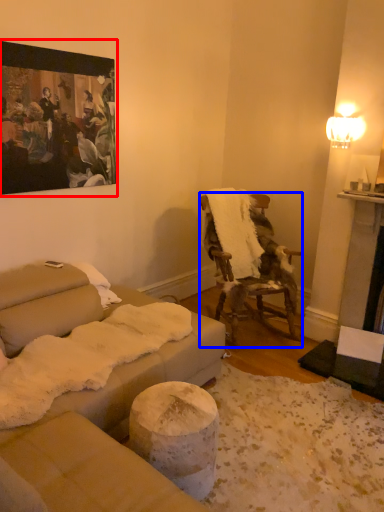
Question: Among these objects, which one is nearest to the camera, picture frame (highlighted by a red box) or chair (highlighted by a blue box)?

Choices:
 (A) picture frame
 (B) chair

Answer: (A)